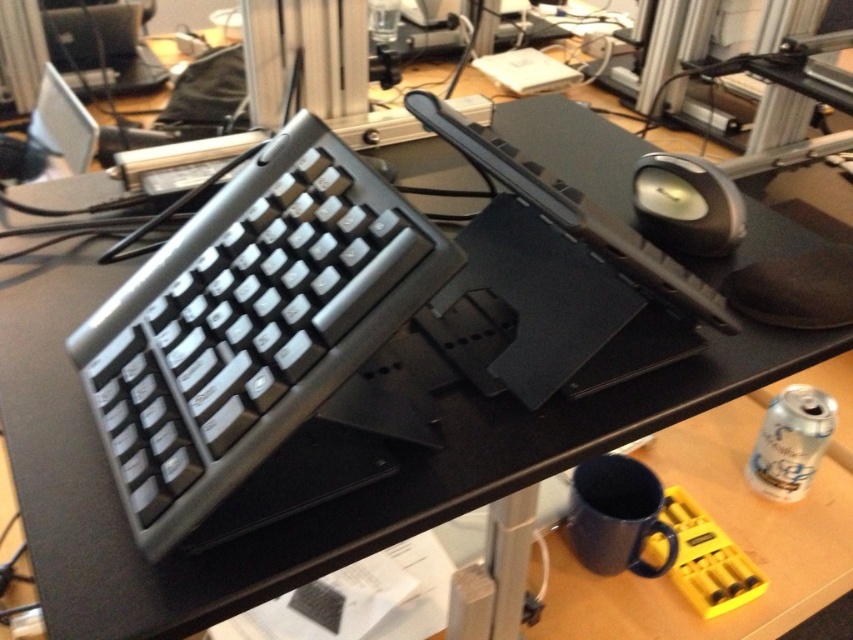
How distant is silver metallic keyboard at left from black rubber mouse at upper right?

silver metallic keyboard at left is 12.64 inches away from black rubber mouse at upper right.

Which of these two, silver metallic keyboard at left or black rubber mouse at upper right, stands shorter?

With less height is black rubber mouse at upper right.

Is point (144, 381) farther from viewer compared to point (636, 198)?

No.

Find the location of `silver metallic keyboard at left`. silver metallic keyboard at left is located at coordinates (250, 324).